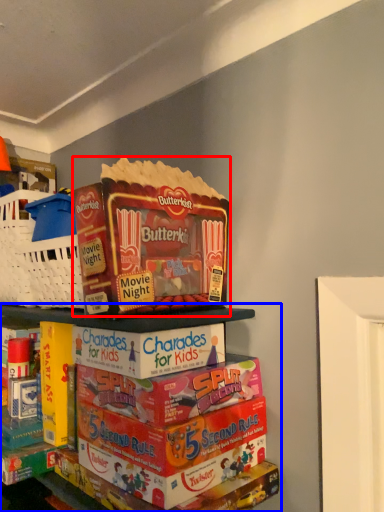
Question: Which point is further to the camera, product (highlighted by a red box) or shelf (highlighted by a blue box)?

Choices:
 (A) product
 (B) shelf

Answer: (A)